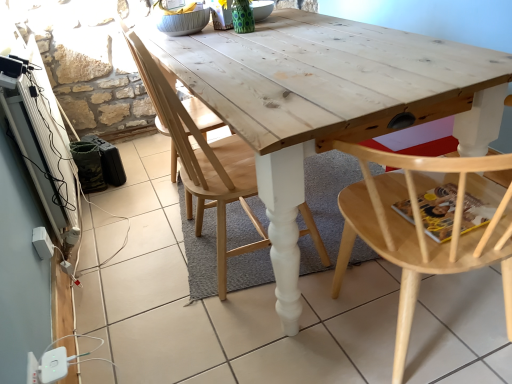
Question: Is natural wood chair at center, which is the second chair in right-to-left order, spatially inside natural wood chair at center, positioned as the 3th chair in right-to-left order, or outside of it?

Choices:
 (A) outside
 (B) inside

Answer: (A)

Question: From the image's perspective, is natural wood chair at center, which appears as the 2th chair when viewed from the left, located above or below natural wood chair at center, placed as the first chair when sorted from left to right?

Choices:
 (A) below
 (B) above

Answer: (A)

Question: Estimate the real-world distances between objects in this image. Which object is closer to the natural wood chair at center, positioned as the 3th chair in right-to-left order?

Choices:
 (A) natural wood chair at center, which appears as the 2th chair when viewed from the left
 (B) natural wood chair at center, which ranks as the third chair in left-to-right order
 (C) natural wood table at center

Answer: (A)

Question: Estimate the real-world distances between objects in this image. Which object is farther from the natural wood chair at center, which is the second chair in right-to-left order?

Choices:
 (A) natural wood chair at center, acting as the 1th chair starting from the right
 (B) natural wood chair at center, positioned as the 3th chair in right-to-left order
 (C) natural wood table at center

Answer: (A)